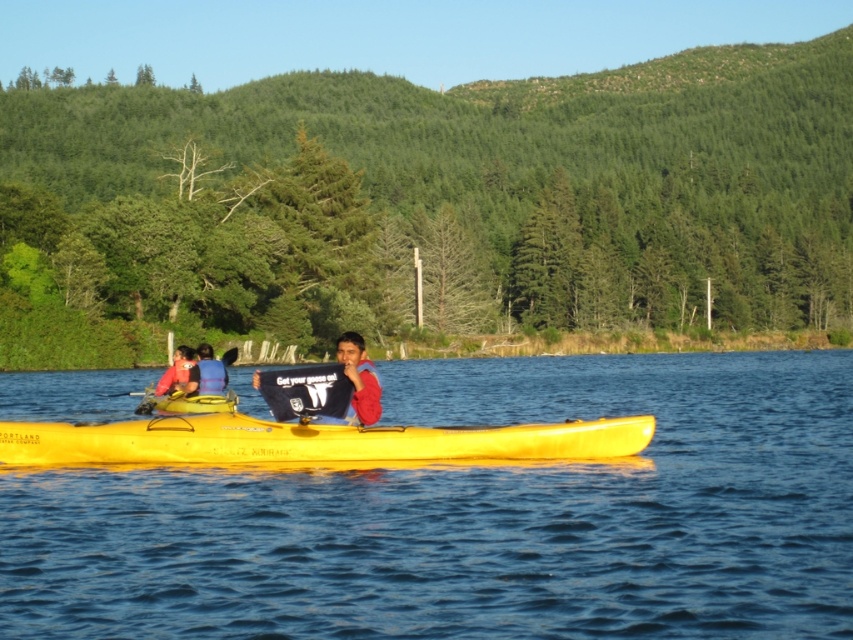
Does yellow plastic kayak at center lie behind matte pink shirt at left?

No, yellow plastic kayak at center is in front of matte pink shirt at left.

Is point (671, 392) closer to viewer compared to point (184, 362)?

No.

Identify the location of yellow plastic kayak at center. (474, 518).

Does yellow plastic canoe at center appear on the left side of matte pink shirt at left?

Incorrect, yellow plastic canoe at center is not on the left side of matte pink shirt at left.

Is yellow plastic canoe at center to the right of matte pink shirt at left from the viewer's perspective?

Indeed, yellow plastic canoe at center is positioned on the right side of matte pink shirt at left.

Which is behind, point (566, 452) or point (175, 371)?

Point (175, 371)

I want to click on yellow plastic canoe at center, so click(310, 442).

Which of these two, yellow plastic kayak at center or yellow plastic canoe at center, stands shorter?

Standing shorter between the two is yellow plastic canoe at center.

Who is more distant from viewer, (x=381, y=474) or (x=186, y=442)?

The point (x=381, y=474) is more distant.

Is point (103, 397) positioned after point (194, 422)?

Yes, it is.

Where is `yellow plastic kayak at center`? The width and height of the screenshot is (853, 640). yellow plastic kayak at center is located at coordinates (474, 518).